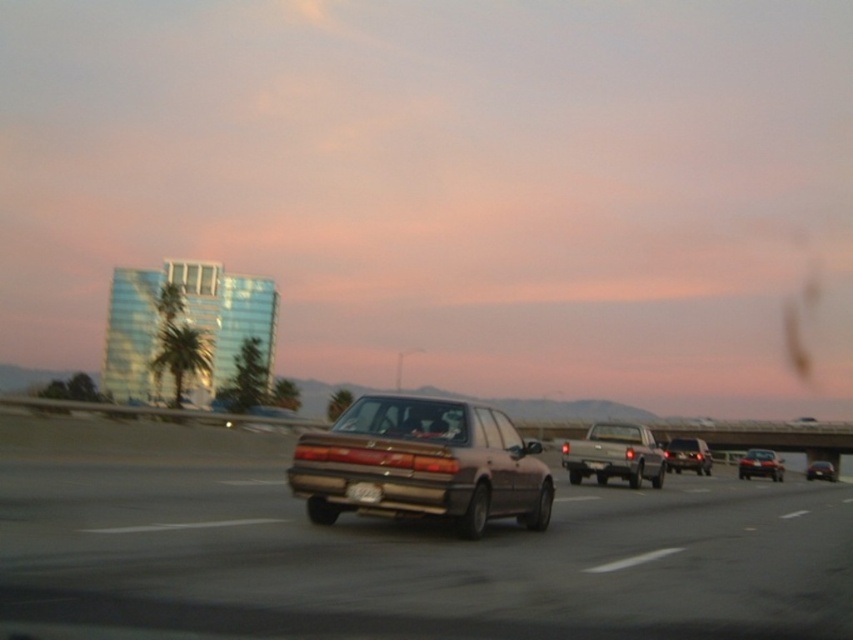
You are a driver approaching the highway and notice two sedans at the center lane. The satin brown sedan at center and the metallic silver sedan at center. Which one is wider?

The metallic silver sedan at center is wider than the satin brown sedan at center.

From the picture: You are driving a car and see the green leafy palm tree at left and the matte black sedan at center on the road ahead. Which object is closer to the left edge of the road?

The green leafy palm tree at left is positioned on the left side of the matte black sedan at center, so it is closer to the left edge of the road.

You are a driver approaching the highway and see two sedans ahead of you. The first is a satin brown sedan at center and the second is a metallic silver sedan at center. Which sedan is closer to the left side of the highway?

The satin brown sedan at center is positioned on the left side of the metallic silver sedan at center, so it is closer to the left side of the highway.